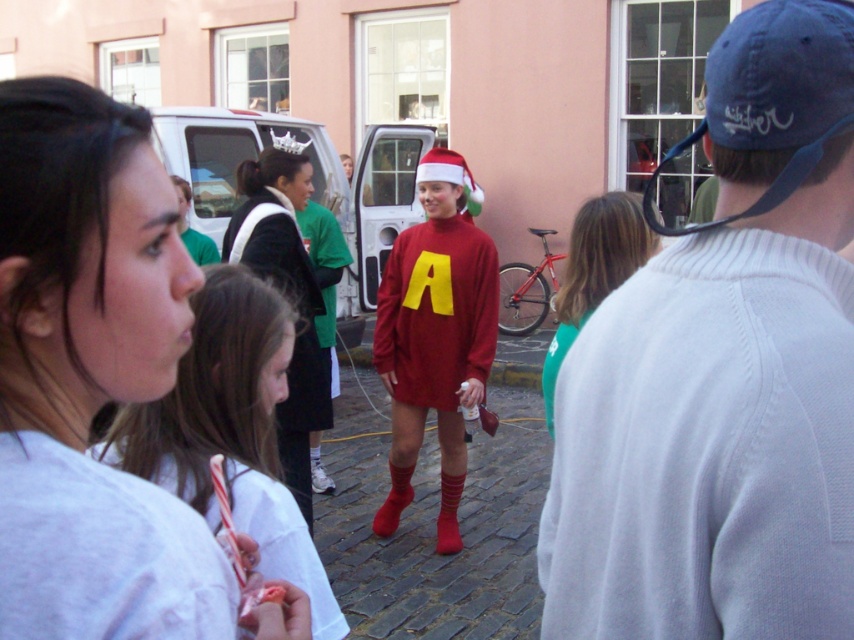
You are organizing a clothing display and need to place the matte red sweater at center and the green matte shirt at center side by side. Which one should you place first to ensure they fit within the display area?

The matte red sweater at center is wider than the green matte shirt at center, so you should place the matte red sweater at center first to accommodate its larger width in the display area.

You are organizing a clothing donation drive and need to sort items based on size. You come across the white knit sweater at center and the white matte shirt at center. Which item should you place in the large size bin?

The white knit sweater at center should be placed in the large size bin since it is bigger than the white matte shirt at center.